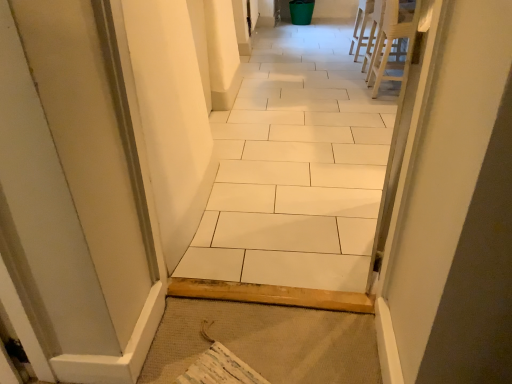
Question: Does white plastic chair at upper right, which ranks as the second chair in front-to-back order, appear on the right side of white ceramic tile at center?

Choices:
 (A) yes
 (B) no

Answer: (A)

Question: Is white plastic chair at upper right, which appears as the first chair when viewed from the back, positioned with its back to white ceramic tile at center?

Choices:
 (A) no
 (B) yes

Answer: (A)

Question: Are white plastic chair at upper right, which appears as the first chair when viewed from the back, and white ceramic tile at center making contact?

Choices:
 (A) no
 (B) yes

Answer: (A)

Question: From a real-world perspective, is white plastic chair at upper right, which appears as the first chair when viewed from the back, positioned under white ceramic tile at center based on gravity?

Choices:
 (A) yes
 (B) no

Answer: (A)

Question: Can you confirm if white plastic chair at upper right, which appears as the first chair when viewed from the back, is shorter than white ceramic tile at center?

Choices:
 (A) no
 (B) yes

Answer: (B)

Question: From the image's perspective, relative to white ceramic tile at center, is white plastic chair at upper right, which ranks as the second chair in front-to-back order, above or below?

Choices:
 (A) above
 (B) below

Answer: (A)

Question: Relative to white ceramic tile at center, is white plastic chair at upper right, which ranks as the second chair in front-to-back order, in front or behind?

Choices:
 (A) front
 (B) behind

Answer: (B)

Question: In terms of height, does white plastic chair at upper right, which ranks as the second chair in front-to-back order, look taller or shorter compared to white ceramic tile at center?

Choices:
 (A) tall
 (B) short

Answer: (B)

Question: From a real-world perspective, is white plastic chair at upper right, which appears as the first chair when viewed from the back, above or below white ceramic tile at center?

Choices:
 (A) above
 (B) below

Answer: (B)

Question: Is white plastic chair at upper right, the 1th chair when ordered from front to back, bigger or smaller than white plastic chair at upper right, which appears as the first chair when viewed from the back?

Choices:
 (A) small
 (B) big

Answer: (B)

Question: Considering the positions of white plastic chair at upper right, the 1th chair when ordered from front to back, and white plastic chair at upper right, which appears as the first chair when viewed from the back, in the image, is white plastic chair at upper right, the 1th chair when ordered from front to back, taller or shorter than white plastic chair at upper right, which appears as the first chair when viewed from the back,?

Choices:
 (A) short
 (B) tall

Answer: (B)

Question: Visually, is white plastic chair at upper right, the 1th chair when ordered from front to back, positioned to the left or to the right of white plastic chair at upper right, which ranks as the second chair in front-to-back order?

Choices:
 (A) left
 (B) right

Answer: (A)

Question: Considering their positions, is white plastic chair at upper right, placed as the 2th chair when sorted from back to front, located in front of or behind white plastic chair at upper right, which ranks as the second chair in front-to-back order?

Choices:
 (A) behind
 (B) front

Answer: (B)

Question: Looking at their shapes, would you say white ceramic tile at center is wider or thinner than white plastic chair at upper right, placed as the 2th chair when sorted from back to front?

Choices:
 (A) thin
 (B) wide

Answer: (A)

Question: From the image's perspective, is white ceramic tile at center above or below white plastic chair at upper right, placed as the 2th chair when sorted from back to front?

Choices:
 (A) above
 (B) below

Answer: (B)